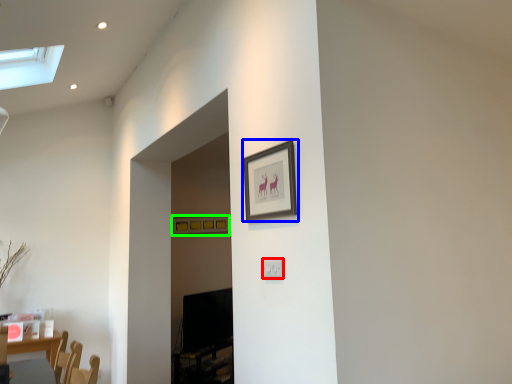
Question: Estimate the real-world distances between objects in this image. Which object is closer to electric outlet (highlighted by a red box), picture frame (highlighted by a blue box) or picture frame (highlighted by a green box)?

Choices:
 (A) picture frame
 (B) picture frame

Answer: (A)